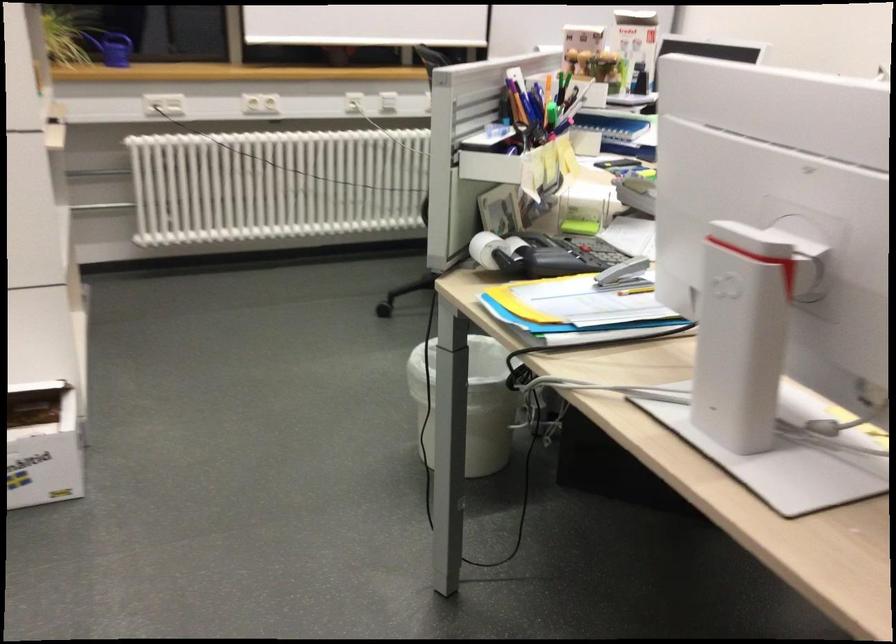
Find where to lift the grey stapler. Please return your answer as a coordinate pair (x, y).

(624, 275)